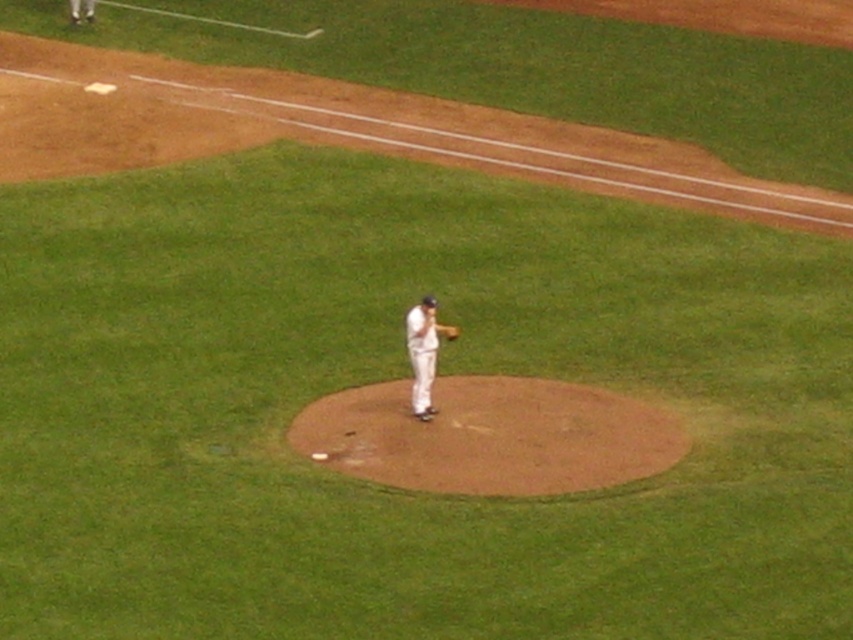
Question: Which object appears closest to the camera in this image?

Choices:
 (A) white fabric pants at upper left
 (B) brown dirt mound at center
 (C) white uniform at center
 (D) brown leather glove at center

Answer: (B)

Question: Is brown dirt mound at center behind brown leather glove at center?

Choices:
 (A) yes
 (B) no

Answer: (B)

Question: Is brown dirt mound at center further to camera compared to brown leather glove at center?

Choices:
 (A) no
 (B) yes

Answer: (A)

Question: Which object appears farthest from the camera in this image?

Choices:
 (A) white fabric pants at upper left
 (B) brown dirt mound at center
 (C) white uniform at center

Answer: (A)

Question: Among these points, which one is nearest to the camera?

Choices:
 (A) (85, 12)
 (B) (329, 442)

Answer: (B)

Question: Is brown dirt mound at center to the right of white fabric pants at upper left from the viewer's perspective?

Choices:
 (A) yes
 (B) no

Answer: (A)